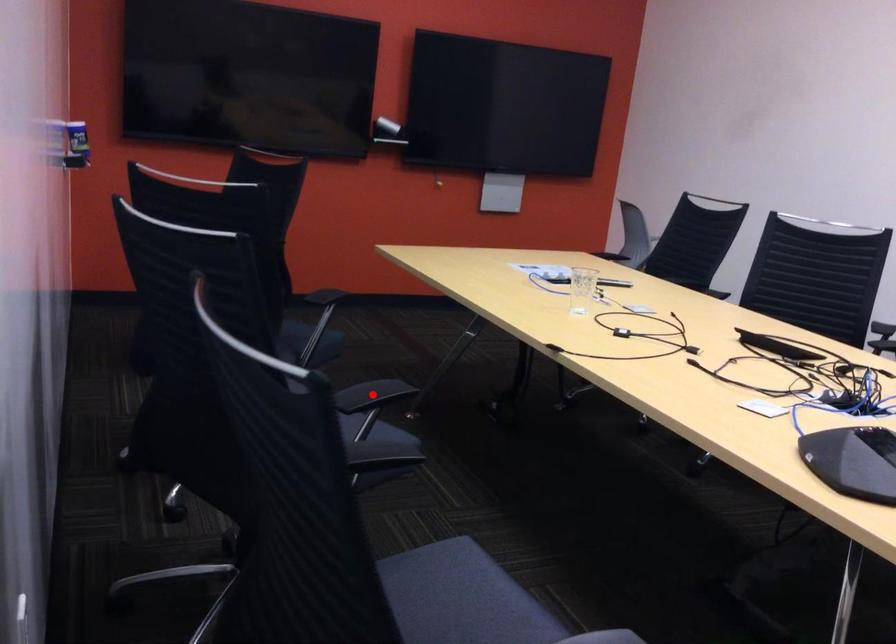
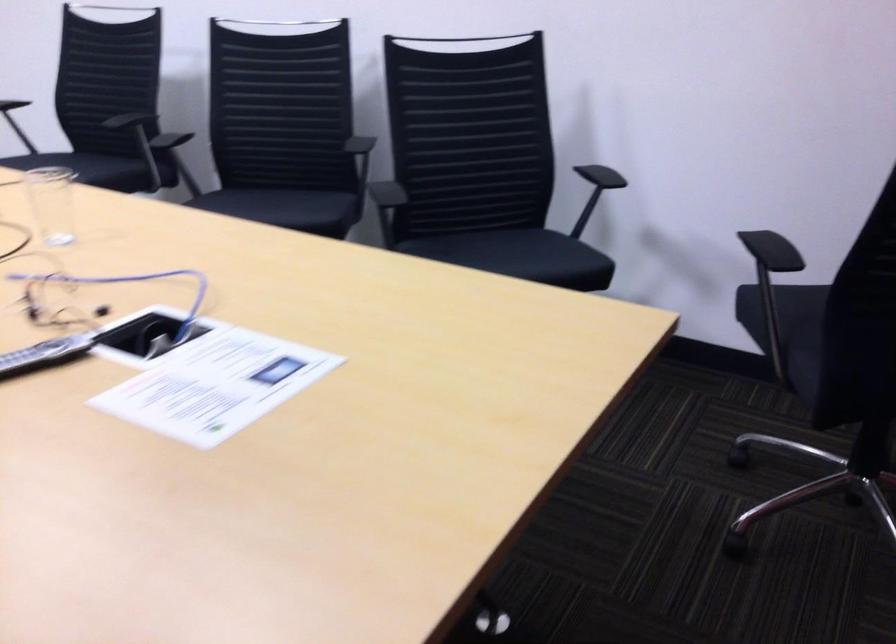
Question: I am providing you with two images of the same scene from different viewpoints. A red point is marked on the first image. Can you still see the location of the red point in image 2?

Choices:
 (A) Yes
 (B) No

Answer: (B)